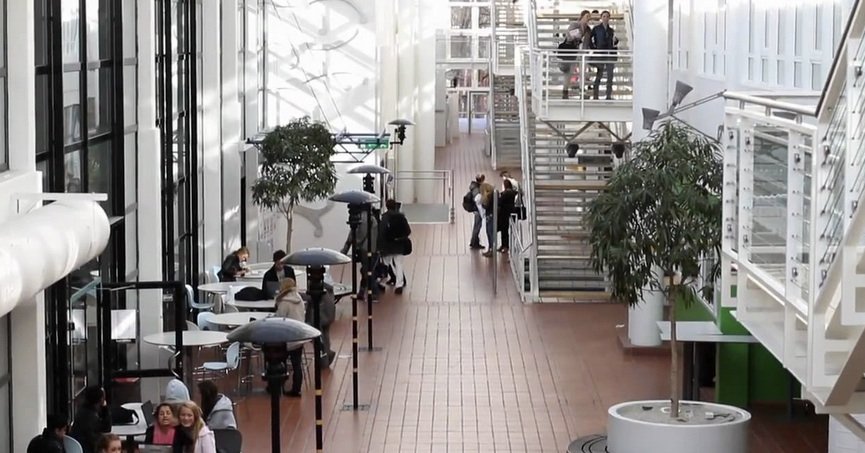
I want to click on stairs, so coord(579,209), coord(498,132).